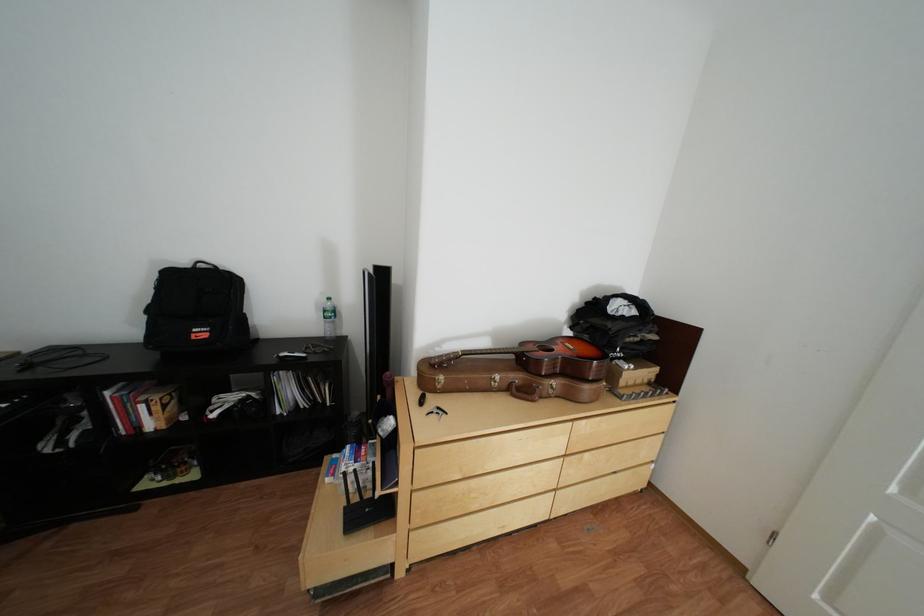
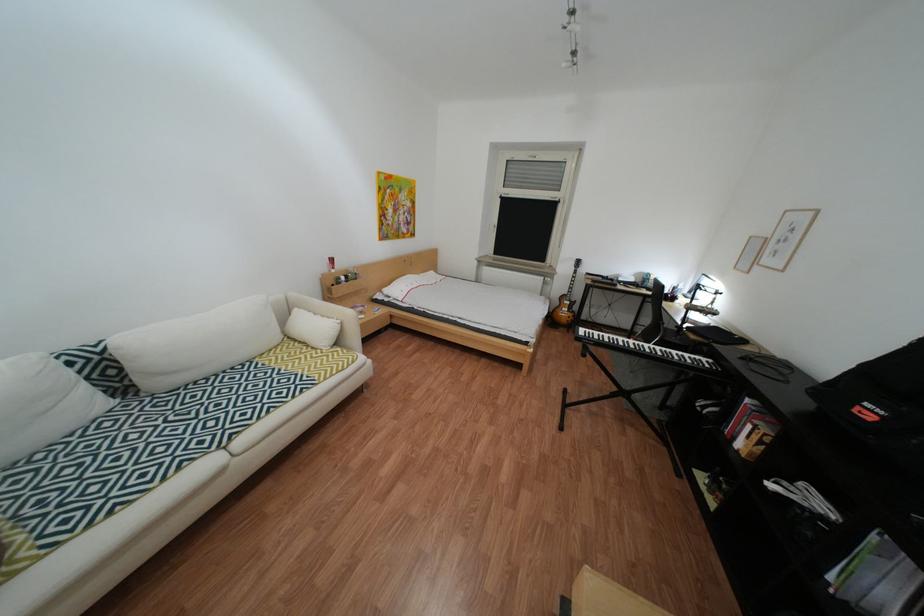
Locate, in the second image, the point that corresponds to pixel 154 429 in the first image.

(749, 439)